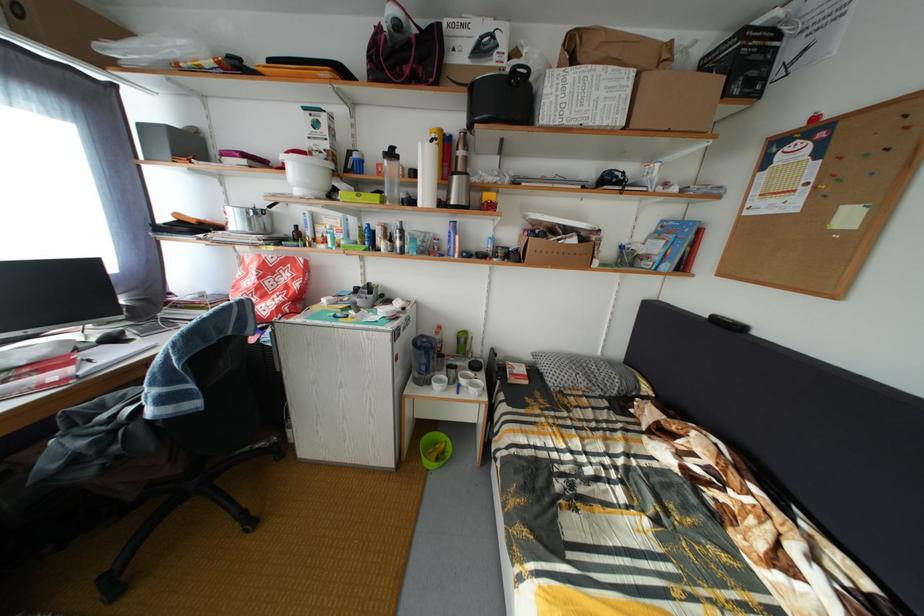
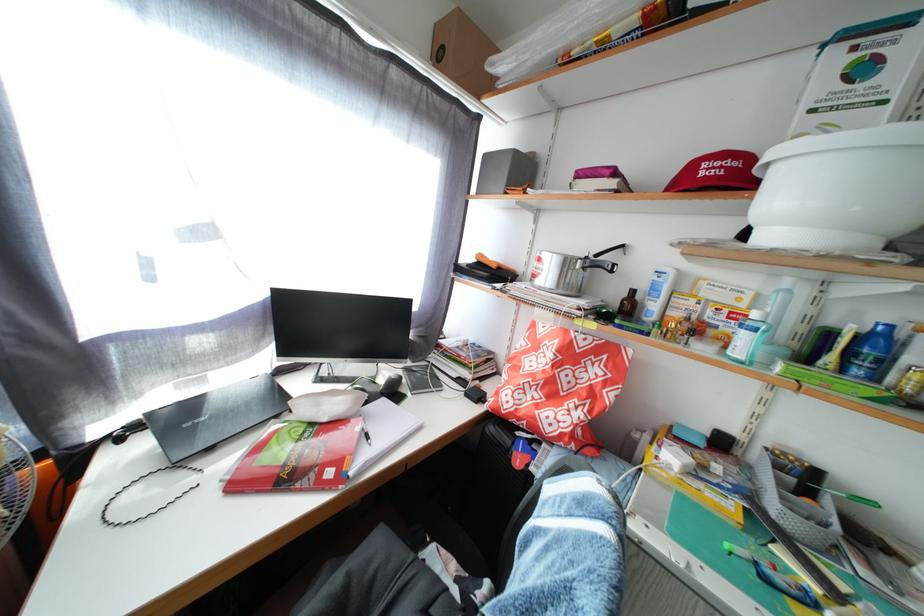
In the second image, find the point that corresponds to point 297,237 in the first image.

(621, 301)